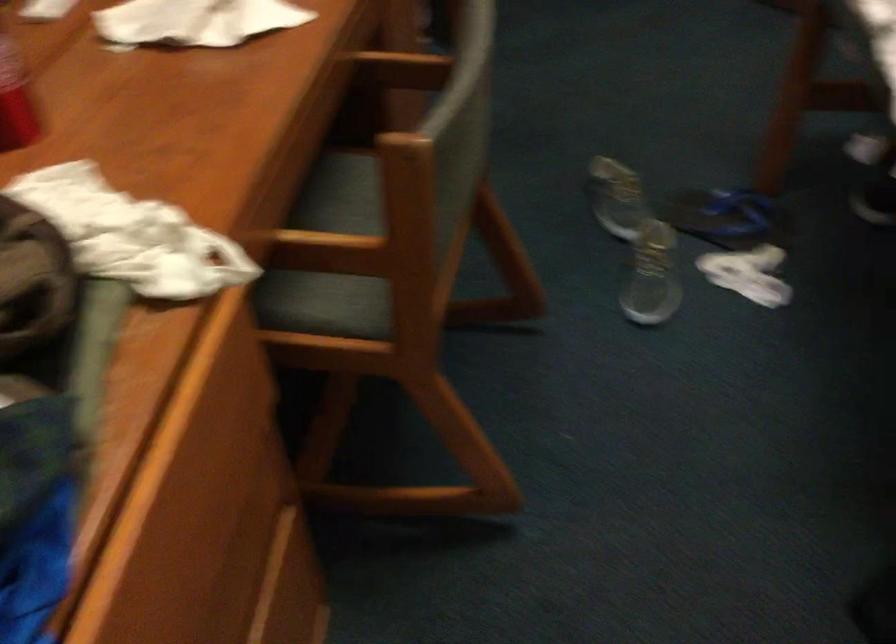
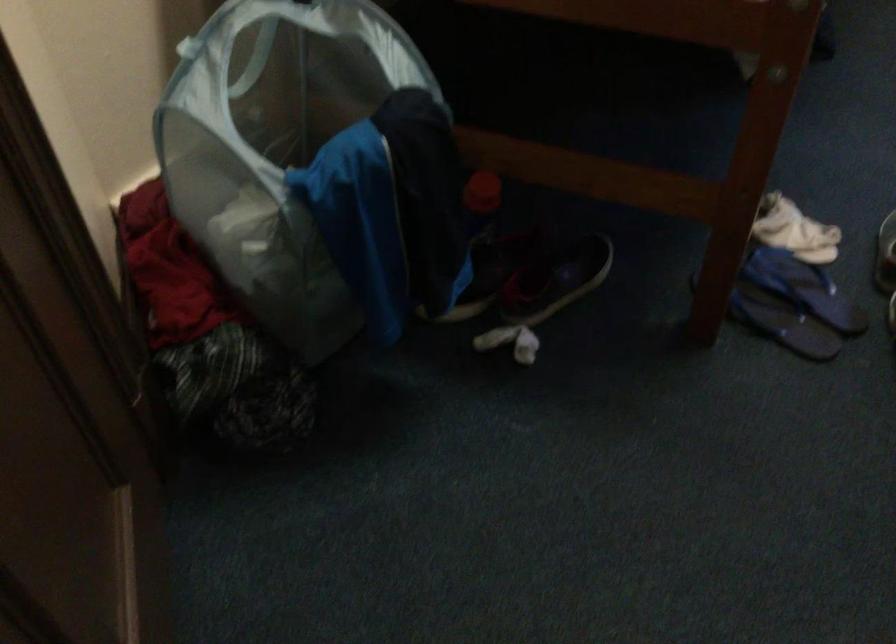
Locate, in the second image, the point that corresponds to the point at 712,200 in the first image.

(782, 323)